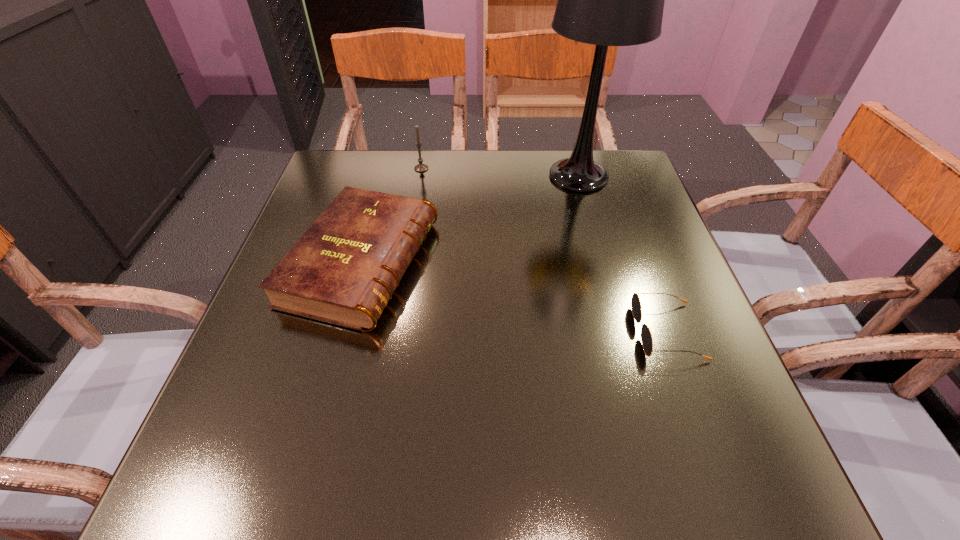
The width and height of the screenshot is (960, 540). I want to click on free space at the far left corner, so 356,167.

What are the coordinates of `vacant space at the far right corner of the desktop` in the screenshot? It's located at (629, 178).

At what (x,y) coordinates should I click in order to perform the action: click on free region at the near right corner. Please return your answer as a coordinate pair (x, y). The width and height of the screenshot is (960, 540). Looking at the image, I should click on (756, 507).

The image size is (960, 540). Find the location of `empty location between the second shortest object and the shortest object`. empty location between the second shortest object and the shortest object is located at coordinates (515, 297).

You are a GUI agent. You are given a task and a screenshot of the screen. Output one action in this format:
    pyautogui.click(x=<x>, y=<y>)
    Task: Click on the free area in between the table lamp and the second tallest object
    
    Given the screenshot: What is the action you would take?
    [500, 172]

Where is `vacant space that's between the second tallest object and the tallest object`? The image size is (960, 540). vacant space that's between the second tallest object and the tallest object is located at coordinates (500, 172).

Locate an element on the screen. vacant space that's between the second tallest object and the table lamp is located at coordinates (500, 172).

Image resolution: width=960 pixels, height=540 pixels. I want to click on free space between the tallest object and the second shortest object, so click(x=470, y=220).

Where is `vacant region between the table lamp and the third shortest object`? vacant region between the table lamp and the third shortest object is located at coordinates (500, 172).

Image resolution: width=960 pixels, height=540 pixels. In order to click on vacant space in between the table lamp and the shortest object in this screenshot , I will do `click(623, 254)`.